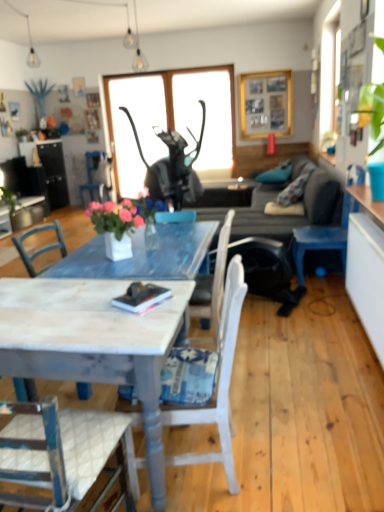
Question: In the image, is transparent glass window screen at center, which is the 1th window screen from right to left, on the left side or the right side of metallic black cat statue at upper center, the second window screen viewed from the right?

Choices:
 (A) right
 (B) left

Answer: (A)

Question: Is transparent glass window screen at center, which is the 1th window screen from right to left, in front of or behind metallic black cat statue at upper center, the first window screen positioned from the left, in the image?

Choices:
 (A) behind
 (B) front

Answer: (B)

Question: Estimate the real-world distances between objects in this image. Which object is farther from the blue painted wood chair at center, the 3th chair when ordered from bottom to top?

Choices:
 (A) matte glass light fixture at upper center
 (B) blue painted wood chair at right, the second chair in the bottom-to-top sequence
 (C) transparent glass window screen at center, which is the 1th window screen from right to left
 (D) hardcover book at center
 (E) metallic black cat statue at upper center, the second window screen viewed from the right

Answer: (D)

Question: Estimate the real-world distances between objects in this image. Which object is farther from the transparent glass window screen at center, which is the 1th window screen from right to left?

Choices:
 (A) white painted wood desk at center
 (B) metallic black cat statue at upper center, the second window screen viewed from the right
 (C) white painted wood chair at center, arranged as the first chair when viewed from the front
 (D) wooden picture frame at upper center
 (E) blue painted wood chair at center, the 3th chair when ordered from right to left

Answer: (A)